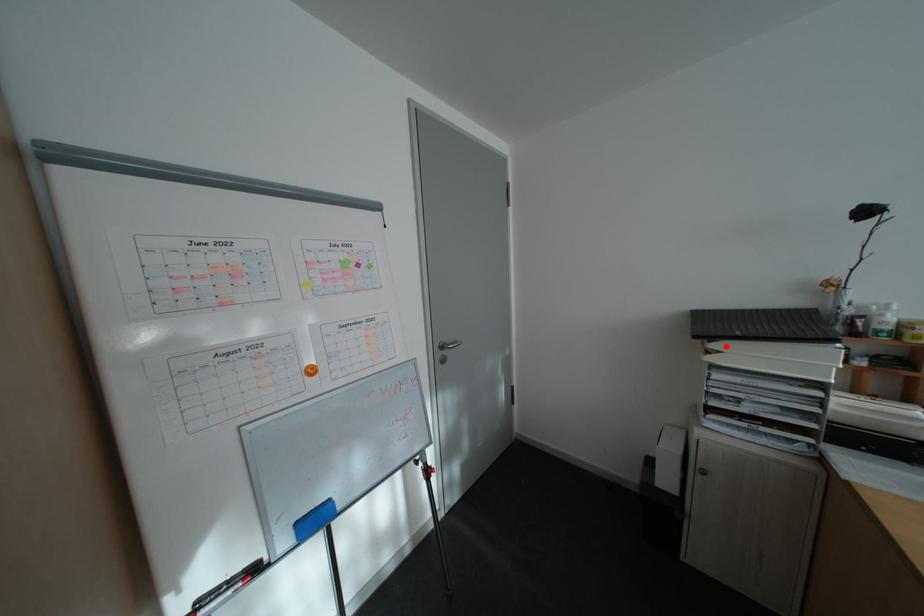
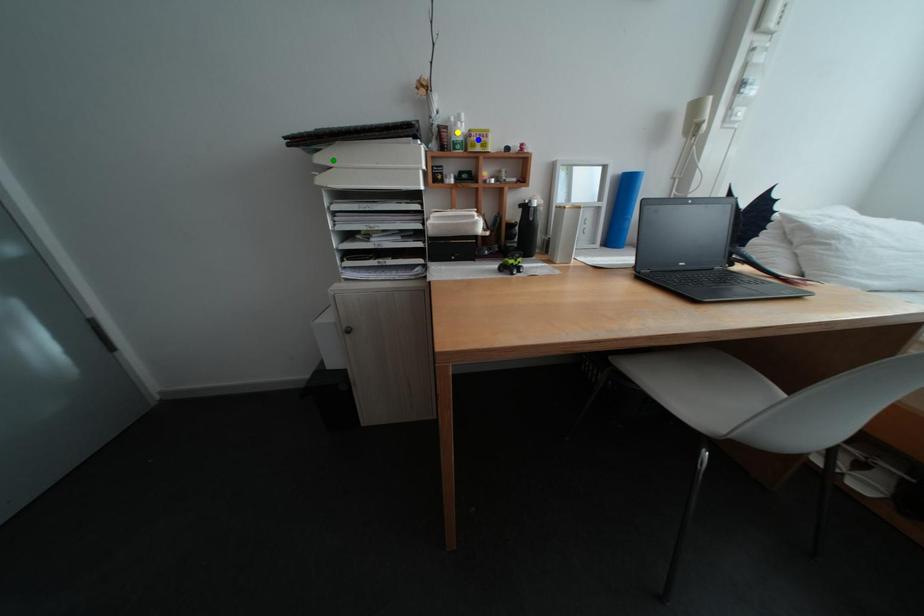
Question: I am providing you with two images of the same scene from different viewpoints. A red point is marked on the first image. You are given multiple points on the second image. Which spot in image 2 lines up with the point in image 1?

Choices:
 (A) blue point
 (B) yellow point
 (C) green point

Answer: (C)